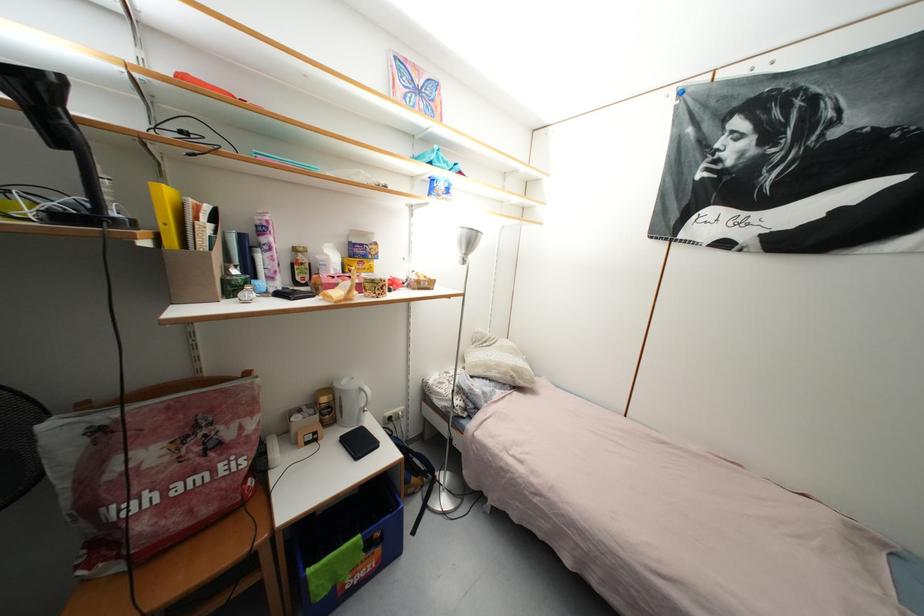
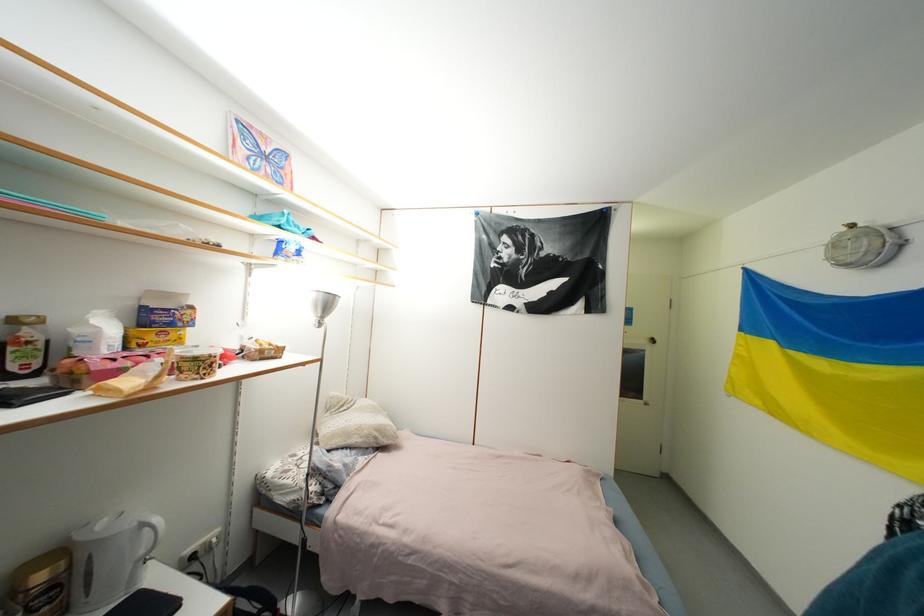
Where in the second image is the point corresponding to point (476, 243) from the first image?

(333, 306)